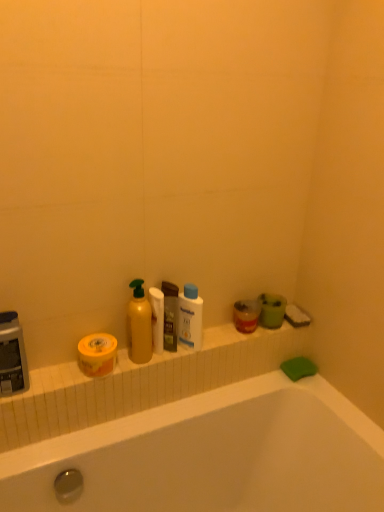
Question: From a real-world perspective, is yellow matte bottle at center, which appears as the second cleaning product when viewed from the right, located beneath translucent plastic mouthwash at center, marked as the second mouthwash in a left-to-right arrangement?

Choices:
 (A) yes
 (B) no

Answer: (B)

Question: Is yellow matte bottle at center, which appears as the second cleaning product when viewed from the right, smaller than translucent plastic mouthwash at center, marked as the second mouthwash in a left-to-right arrangement?

Choices:
 (A) yes
 (B) no

Answer: (B)

Question: Can you confirm if yellow matte bottle at center, which appears as the second cleaning product when viewed from the right, is taller than translucent plastic mouthwash at center, which is the 1th mouthwash in right-to-left order?

Choices:
 (A) no
 (B) yes

Answer: (B)

Question: Does yellow matte bottle at center, positioned as the first cleaning product in left-to-right order, come behind translucent plastic mouthwash at center, which is the 1th mouthwash in right-to-left order?

Choices:
 (A) no
 (B) yes

Answer: (A)

Question: From the image's perspective, is yellow matte bottle at center, positioned as the first cleaning product in left-to-right order, beneath translucent plastic mouthwash at center, which is the 1th mouthwash in right-to-left order?

Choices:
 (A) yes
 (B) no

Answer: (B)

Question: Is yellow matte bottle at center, which appears as the second cleaning product when viewed from the right, to the right of translucent plastic mouthwash at center, marked as the second mouthwash in a left-to-right arrangement, from the viewer's perspective?

Choices:
 (A) no
 (B) yes

Answer: (A)

Question: Can yellow matte bottle at center, positioned as the first cleaning product in left-to-right order, be found inside white matte toilet paper at center?

Choices:
 (A) no
 (B) yes

Answer: (A)

Question: Does white matte toilet paper at center have a lesser width compared to yellow matte bottle at center, positioned as the first cleaning product in left-to-right order?

Choices:
 (A) no
 (B) yes

Answer: (B)

Question: Is white matte toilet paper at center shorter than yellow matte bottle at center, which appears as the second cleaning product when viewed from the right?

Choices:
 (A) no
 (B) yes

Answer: (B)

Question: From the image's perspective, does white matte toilet paper at center appear lower than yellow matte bottle at center, which appears as the second cleaning product when viewed from the right?

Choices:
 (A) no
 (B) yes

Answer: (B)

Question: Does white matte toilet paper at center turn towards yellow matte bottle at center, which appears as the second cleaning product when viewed from the right?

Choices:
 (A) no
 (B) yes

Answer: (A)

Question: Considering the relative sizes of white matte toilet paper at center and yellow matte bottle at center, positioned as the first cleaning product in left-to-right order, in the image provided, is white matte toilet paper at center taller than yellow matte bottle at center, positioned as the first cleaning product in left-to-right order,?

Choices:
 (A) yes
 (B) no

Answer: (B)

Question: Is translucent plastic mouthwash at center, marked as the second mouthwash in a left-to-right arrangement, positioned with its back to white matte toilet paper at center?

Choices:
 (A) yes
 (B) no

Answer: (B)